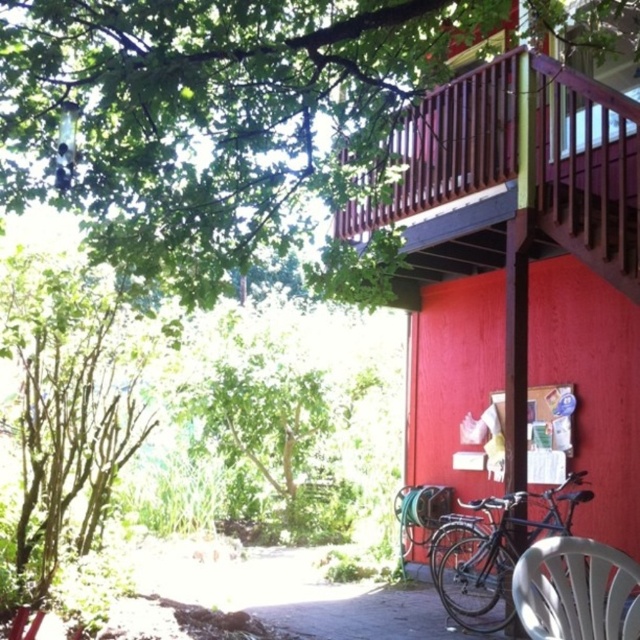
Question: Is red matte wood shed at center to the left of white plastic chair at lower right from the viewer's perspective?

Choices:
 (A) yes
 (B) no

Answer: (B)

Question: Is wooden at upper right in front of white plastic chair at lower right?

Choices:
 (A) yes
 (B) no

Answer: (B)

Question: Which point is farther to the camera?

Choices:
 (A) 506,605
 (B) 371,220
 (C) 0,12

Answer: (B)

Question: Among these objects, which one is nearest to the camera?

Choices:
 (A) green leafy tree at upper left
 (B) green leafy tree at left
 (C) wooden at upper right

Answer: (A)

Question: Does green leafy tree at left appear on the right side of shiny black bicycle at lower right?

Choices:
 (A) yes
 (B) no

Answer: (B)

Question: Based on their relative distances, which object is farther from the green leafy tree at upper left?

Choices:
 (A) white plastic chair at lower right
 (B) shiny black bicycle at lower right

Answer: (A)